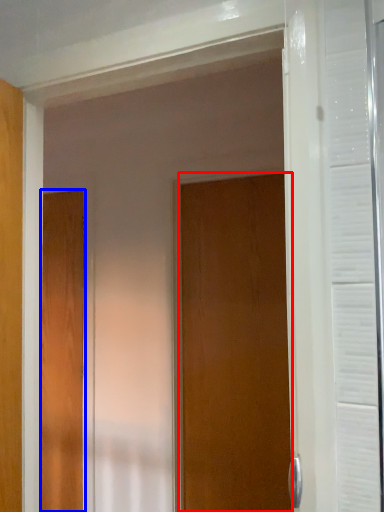
Question: Which of the following is the farthest to the observer, door (highlighted by a red box) or door (highlighted by a blue box)?

Choices:
 (A) door
 (B) door

Answer: (B)